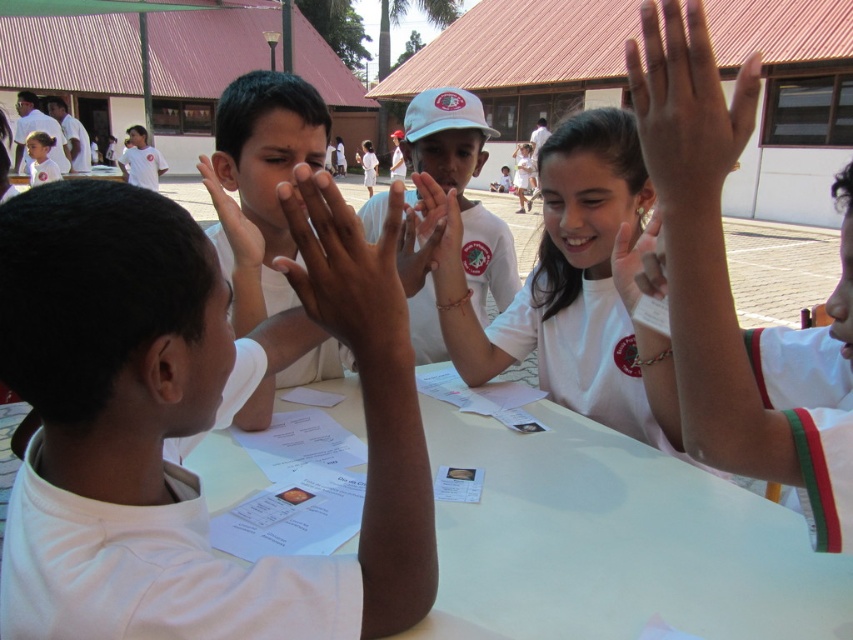
Question: Does white smooth table at center appear on the right side of smooth skin hand at center?

Choices:
 (A) yes
 (B) no

Answer: (A)

Question: Estimate the real-world distances between objects in this image. Which object is closer to the white matte shirt at upper left?

Choices:
 (A) white matte cap at center
 (B) smooth skin hand at center
 (C) smooth skin hands at center

Answer: (C)

Question: Among these objects, which one is nearest to the camera?

Choices:
 (A) smooth skin hands at center
 (B) white matte shirt at upper left

Answer: (B)

Question: Does smooth skin hands at center appear on the right side of smooth skin hand at center?

Choices:
 (A) yes
 (B) no

Answer: (B)

Question: Where is matte white hand at upper right located in relation to smooth skin hands at center in the image?

Choices:
 (A) right
 (B) left

Answer: (A)

Question: Which point appears closest to the camera in this image?

Choices:
 (A) (451, 301)
 (B) (659, 292)
 (C) (653, 4)

Answer: (C)